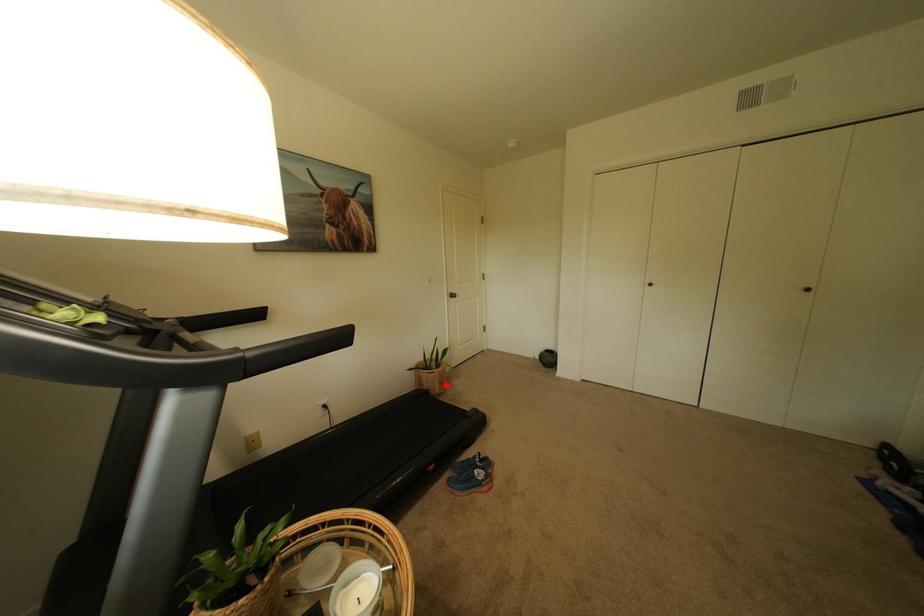
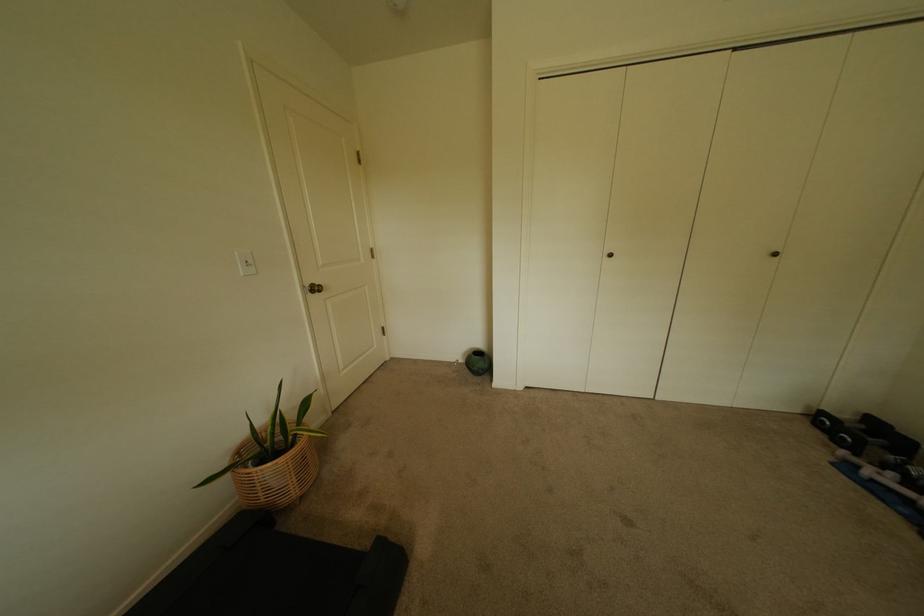
Where in the second image is the point corresponding to the highlighted location from the first image?

(302, 480)